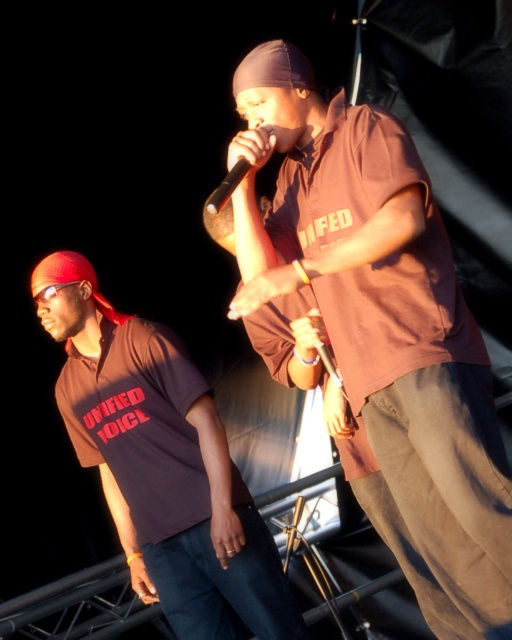
You are a stagehand who needs to place a new spotlight at coordinates point 0.727, 0.316 to highlight the matte brown shirt at center. Based on the stage setup, where should you aim the spotlight?

The spotlight should be aimed at the matte brown shirt at center since it is located at point (161, 465).

You are an event organizer who needs to arrange seating for two performers based on their shirt details. The performers are wearing brown matte shirt at center and matte brown shirt at center. According to the scene, which performer should sit in the front row based on their shirt characteristics?

The brown matte shirt at center should sit in the front row because it is taller than the matte brown shirt at center.